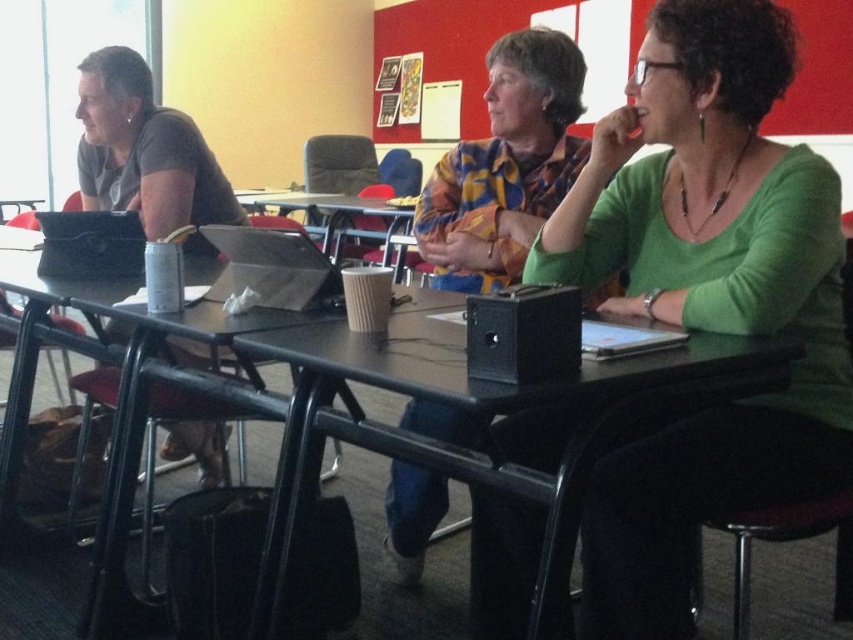
Does point (579, 65) come farther from viewer compared to point (248, 234)?

Yes, point (579, 65) is behind point (248, 234).

Describe the element at coordinates (505, 164) in the screenshot. The height and width of the screenshot is (640, 853). I see `floral shirt at center` at that location.

Identify the location of floral shirt at center. The width and height of the screenshot is (853, 640). (505, 164).

Does matte gray shirt at left have a lesser height compared to brown paper cup at center?

Correct, matte gray shirt at left is not as tall as brown paper cup at center.

Where is `matte gray shirt at left`? matte gray shirt at left is located at coordinates (144, 150).

Is the position of black plastic table at center less distant than that of matte silver laptop at center?

Yes, it is in front of matte silver laptop at center.

Can you confirm if black plastic table at center is thinner than matte silver laptop at center?

In fact, black plastic table at center might be wider than matte silver laptop at center.

Locate an element on the screen. black plastic table at center is located at coordinates (479, 413).